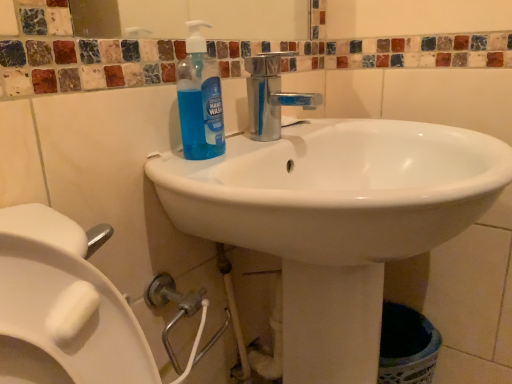
From the picture: What is the approximate width of white glossy sink at center?

white glossy sink at center is 18.73 inches wide.

Describe the element at coordinates (336, 220) in the screenshot. I see `white glossy sink at center` at that location.

Identify the location of white glossy sink at center. (336, 220).

Measure the distance between white glossy sink at center and camera.

They are 17.48 inches apart.

The height and width of the screenshot is (384, 512). I want to click on blue translucent liquid at sink, so click(x=200, y=99).

Describe the element at coordinates (200, 99) in the screenshot. The height and width of the screenshot is (384, 512). I see `blue translucent liquid at sink` at that location.

I want to click on white glossy sink at center, so click(336, 220).

Which object is positioned more to the right, white glossy sink at center or blue translucent liquid at sink?

white glossy sink at center.

Is white glossy sink at center positioned before blue translucent liquid at sink?

Yes, it is.

Does point (422, 182) come farther from viewer compared to point (183, 76)?

Yes.

From the image's perspective, which object appears higher, white glossy sink at center or blue translucent liquid at sink?

blue translucent liquid at sink.

Looking at this image, from a real-world perspective, which object rests below the other?

white glossy sink at center.

Can you confirm if white glossy sink at center is thinner than blue translucent liquid at sink?

No.

Considering the sizes of objects white glossy sink at center and blue translucent liquid at sink in the image provided, who is taller, white glossy sink at center or blue translucent liquid at sink?

Standing taller between the two is white glossy sink at center.

Considering the sizes of objects white glossy sink at center and blue translucent liquid at sink in the image provided, who is smaller, white glossy sink at center or blue translucent liquid at sink?

Smaller between the two is blue translucent liquid at sink.

Is white glossy sink at center completely or partially outside of blue translucent liquid at sink?

Yes.

Is white glossy sink at center in contact with blue translucent liquid at sink?

No, white glossy sink at center is not next to blue translucent liquid at sink.

Could you tell me if white glossy sink at center is facing blue translucent liquid at sink?

No, white glossy sink at center is not aimed at blue translucent liquid at sink.

Locate an element on the screen. This screenshot has height=384, width=512. sink on the right of the blue translucent liquid at sink is located at coordinates (336, 220).

Which object is positioned more to the left, blue translucent liquid at sink or white glossy sink at center?

Positioned to the left is blue translucent liquid at sink.

Is blue translucent liquid at sink in front of or behind white glossy sink at center in the image?

A: In the image, blue translucent liquid at sink appears behind white glossy sink at center.

Which point is more forward, [219,142] or [289,187]?

The point [219,142] is in front.

From the image's perspective, is blue translucent liquid at sink above or below white glossy sink at center?

blue translucent liquid at sink is above white glossy sink at center.

From a real-world perspective, which is physically above, blue translucent liquid at sink or white glossy sink at center?

In real-world perspective, blue translucent liquid at sink is above.

Looking at their sizes, would you say blue translucent liquid at sink is wider or thinner than white glossy sink at center?

Clearly, blue translucent liquid at sink has less width compared to white glossy sink at center.

From their relative heights in the image, would you say blue translucent liquid at sink is taller or shorter than white glossy sink at center?

In the image, blue translucent liquid at sink appears to be shorter than white glossy sink at center.

Is blue translucent liquid at sink smaller than white glossy sink at center?

Yes, blue translucent liquid at sink is smaller than white glossy sink at center.

Which is correct: blue translucent liquid at sink is inside white glossy sink at center, or outside of it?

blue translucent liquid at sink lies within the bounds of white glossy sink at center.

Based on the photo, is blue translucent liquid at sink far away from white glossy sink at center?

They are positioned close to each other.

Could you tell me if blue translucent liquid at sink is turned towards white glossy sink at center?

Yes, blue translucent liquid at sink is aimed at white glossy sink at center.

What's the angular difference between blue translucent liquid at sink and white glossy sink at center's facing directions?

The facing directions of blue translucent liquid at sink and white glossy sink at center are 4.24 degrees apart.

This screenshot has height=384, width=512. What are the coordinates of `cleaning product located behind the white glossy sink at center` in the screenshot? It's located at (200, 99).

This screenshot has width=512, height=384. Find the location of `cleaning product above the white glossy sink at center (from a real-world perspective)`. cleaning product above the white glossy sink at center (from a real-world perspective) is located at coordinates (200, 99).

What are the coordinates of `cleaning product lying behind the white glossy sink at center` in the screenshot? It's located at (200, 99).